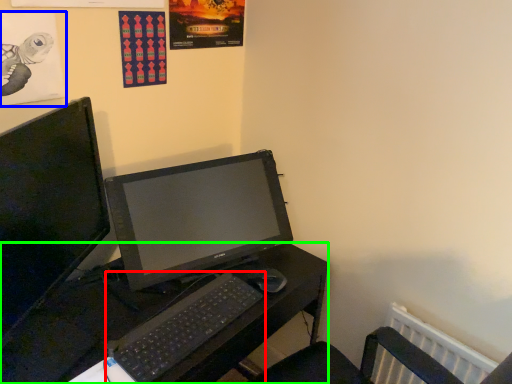
Question: Which is farther away from computer keyboard (highlighted by a red box)? poster page (highlighted by a blue box) or desk (highlighted by a green box)?

Choices:
 (A) poster page
 (B) desk

Answer: (A)